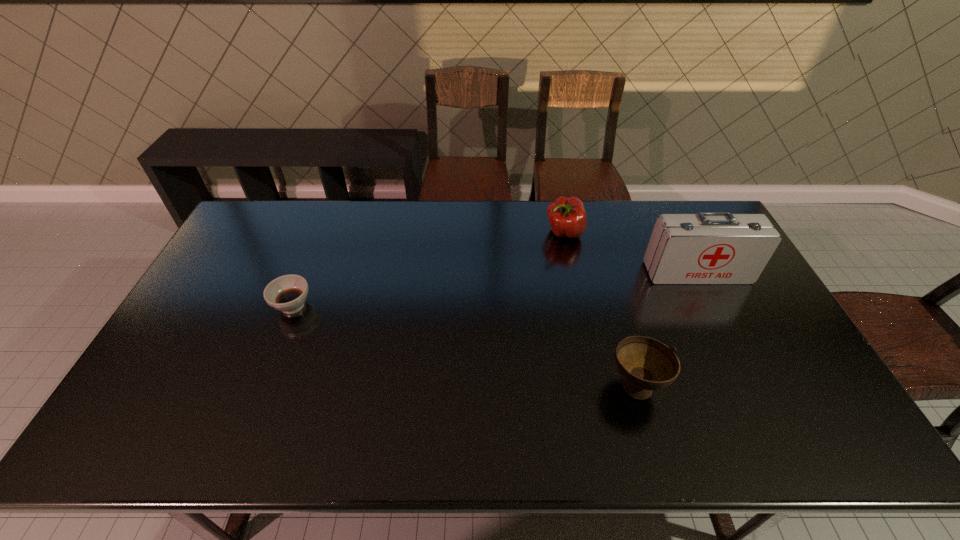
At what (x,y) coordinates should I click in order to perform the action: click on the tallest object. Please return your answer as a coordinate pair (x, y). The height and width of the screenshot is (540, 960). Looking at the image, I should click on (707, 248).

This screenshot has height=540, width=960. Identify the location of the third nearest object. (707, 248).

The height and width of the screenshot is (540, 960). Identify the location of the farthest object. (567, 216).

At what (x,y) coordinates should I click in order to perform the action: click on the taller soup bowl. Please return your answer as a coordinate pair (x, y). Looking at the image, I should click on (646, 364).

Image resolution: width=960 pixels, height=540 pixels. I want to click on the nearer soup bowl, so click(646, 364).

Image resolution: width=960 pixels, height=540 pixels. I want to click on the second nearest object, so click(287, 293).

Locate an element on the screen. The width and height of the screenshot is (960, 540). the leftmost object is located at coordinates point(287,293).

Identify the location of vacant space situated on the front-facing side of the tallest object. The height and width of the screenshot is (540, 960). (730, 338).

The image size is (960, 540). Identify the location of free space located 0.050m on the front of the farthest object. (568, 255).

This screenshot has width=960, height=540. In order to click on vacant area situated on the left of the nearest object in this screenshot , I will do `click(564, 384)`.